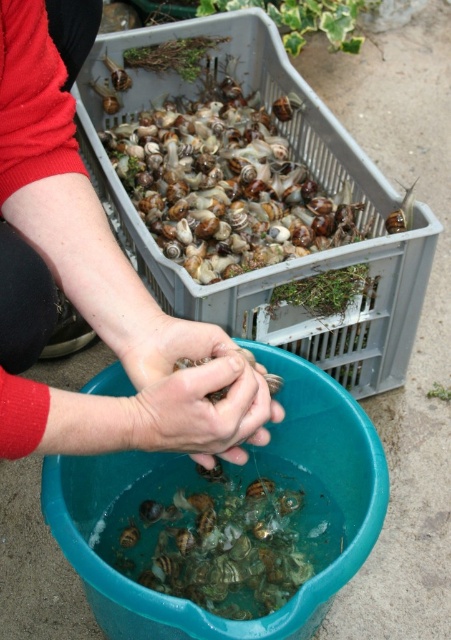
Question: Among these points, which one is farthest from the camera?

Choices:
 (A) (51, 273)
 (B) (133, 422)
 (C) (146, 564)

Answer: (C)

Question: Which of the following is the farthest from the observer?

Choices:
 (A) (165, 372)
 (B) (285, 540)

Answer: (B)

Question: Is translucent plastic crate at upper center closer to camera compared to smooth skin hand at lower center?

Choices:
 (A) yes
 (B) no

Answer: (B)

Question: Which is farther from the smooth skin hands at center?

Choices:
 (A) translucent plastic crate at upper center
 (B) translucent plastic snails at lower center
 (C) smooth skin hand at lower center

Answer: (A)

Question: Can you confirm if smooth skin hands at center is positioned to the left of translucent plastic snails at lower center?

Choices:
 (A) no
 (B) yes

Answer: (B)

Question: Is translucent plastic snails at lower center positioned behind smooth skin hand at lower center?

Choices:
 (A) yes
 (B) no

Answer: (A)